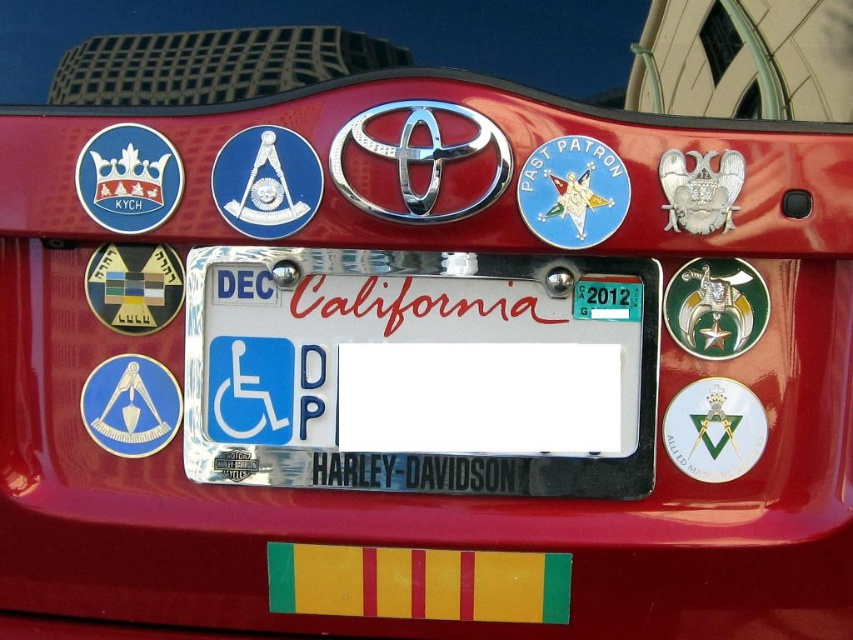
From the picture: You are standing in front of the rear of a red Toyota vehicle. You notice a white plastic license plate located at point (415, 372). Can you determine the exact location of the license plate relative to the Toyota emblem displayed at the top center of the trunk lid?

The white plastic license plate at center is located at point (415, 372), which is directly below the Toyota emblem at the top center of the trunk lid.

You are a car enthusiast examining the rear of the red Toyota vehicle. You notice the blue glossy masonic symbol at lower left and the green plastic sticker at center. Which of these two objects is taller?

The blue glossy masonic symbol at lower left is taller than the green plastic sticker at center.

You are a car enthusiast examining the rear of the red Toyota vehicle. You notice the blue glossy masonic symbol at lower left and the green plastic sticker at center. Which of these two objects is larger in size?

The blue glossy masonic symbol at lower left is bigger than the green plastic sticker at center according to the description provided.